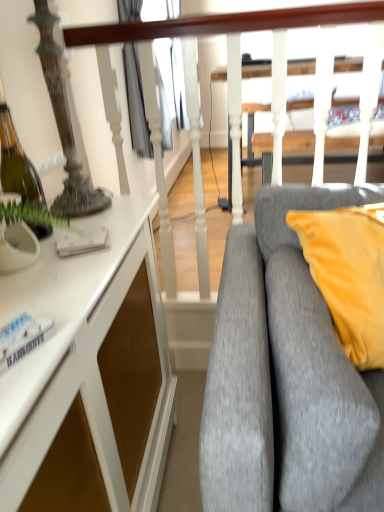
Find the location of a particular element. This screenshot has height=512, width=384. white textured rail at upper center is located at coordinates (226, 23).

Would you say gray fabric couch at right is to the left or to the right of white glossy cabinet at left in the picture?

gray fabric couch at right is positioned on white glossy cabinet at left's right side.

From a real-world perspective, between gray fabric couch at right and white glossy cabinet at left, who is vertically higher?

From a 3D spatial view, gray fabric couch at right is above.

Which object is more forward, gray fabric couch at right or white glossy cabinet at left?

white glossy cabinet at left.

Could you tell me if gray fabric couch at right is turned towards white glossy cabinet at left?

No.

The height and width of the screenshot is (512, 384). I want to click on rail on the right side of white glossy cabinet at left, so click(226, 23).

Considering the relative sizes of white textured rail at upper center and white glossy cabinet at left in the image provided, is white textured rail at upper center shorter than white glossy cabinet at left?

No, white textured rail at upper center is not shorter than white glossy cabinet at left.

Consider the image. Between white textured rail at upper center and white glossy cabinet at left, which one is positioned behind?

white textured rail at upper center is further away from the camera.

From a real-world perspective, is white textured rail at upper center located beneath white glossy cabinet at left?

No, from a real-world perspective, white textured rail at upper center is not under white glossy cabinet at left.

Is white glossy cabinet at left facing towards gray fabric couch at right?

Yes, white glossy cabinet at left is facing gray fabric couch at right.

How much distance is there between white glossy cabinet at left and gray fabric couch at right?

white glossy cabinet at left is 34.32 centimeters from gray fabric couch at right.

Considering the relative sizes of white glossy cabinet at left and gray fabric couch at right in the image provided, is white glossy cabinet at left smaller than gray fabric couch at right?

No, white glossy cabinet at left is not smaller than gray fabric couch at right.

Which is more to the right, white glossy cabinet at left or gray fabric couch at right?

gray fabric couch at right is more to the right.

Is gray fabric couch at right oriented away from white textured rail at upper center?

Yes, white textured rail at upper center is at the back of gray fabric couch at right.

Can you confirm if gray fabric couch at right is smaller than white textured rail at upper center?

Indeed, gray fabric couch at right has a smaller size compared to white textured rail at upper center.

From the picture: Is gray fabric couch at right positioned far away from white textured rail at upper center?

They are positioned close to each other.

Considering the relative positions of gray fabric couch at right and white textured rail at upper center in the image provided, is gray fabric couch at right behind white textured rail at upper center?

No, gray fabric couch at right is in front of white textured rail at upper center.

Does white textured rail at upper center come behind gray fabric couch at right?

Yes.

From a real-world perspective, does white textured rail at upper center sit lower than gray fabric couch at right?

Incorrect, from a real-world perspective, white textured rail at upper center is higher than gray fabric couch at right.

Find the location of a particular element. The width and height of the screenshot is (384, 512). rail above the gray fabric couch at right (from the image's perspective) is located at coordinates (226, 23).

Does white textured rail at upper center have a greater height compared to gray fabric couch at right?

Correct, white textured rail at upper center is much taller as gray fabric couch at right.

Is white textured rail at upper center surrounded by white glossy cabinet at left?

Definitely not — white textured rail at upper center is not inside white glossy cabinet at left.

From the image's perspective, is white glossy cabinet at left located beneath white textured rail at upper center?

Yes, from the image's perspective, white glossy cabinet at left is below white textured rail at upper center.

From the picture: Would you say white glossy cabinet at left is a long distance from white textured rail at upper center?

No, white glossy cabinet at left is in close proximity to white textured rail at upper center.

Can you confirm if white glossy cabinet at left is bigger than white textured rail at upper center?

Yes.

Where is `desk that is below the gray fabric couch at right (from the image's perspective)`? Image resolution: width=384 pixels, height=512 pixels. desk that is below the gray fabric couch at right (from the image's perspective) is located at coordinates (90, 375).

The image size is (384, 512). I want to click on rail on the right of white glossy cabinet at left, so click(226, 23).

Estimate the real-world distances between objects in this image. Which object is closer to white textured rail at upper center, white glossy cabinet at left or gray fabric couch at right?

gray fabric couch at right is closer to white textured rail at upper center.

Looking at this image, when comparing their distances from gray fabric couch at right, does white textured rail at upper center or white glossy cabinet at left seem closer?

white glossy cabinet at left.

When comparing their distances from white textured rail at upper center, does gray fabric couch at right or white glossy cabinet at left seem closer?

gray fabric couch at right is closer to white textured rail at upper center.

Which object lies nearer to the anchor point gray fabric couch at right, white glossy cabinet at left or white textured rail at upper center?

white glossy cabinet at left is closer to gray fabric couch at right.

In the scene shown: From the image, which object appears to be farther from white glossy cabinet at left, gray fabric couch at right or white textured rail at upper center?

Among the two, white textured rail at upper center is located further to white glossy cabinet at left.

From the image, which object appears to be nearer to white glossy cabinet at left, white textured rail at upper center or gray fabric couch at right?

Based on the image, gray fabric couch at right appears to be nearer to white glossy cabinet at left.

I want to click on rail situated between white glossy cabinet at left and gray fabric couch at right from left to right, so click(226, 23).